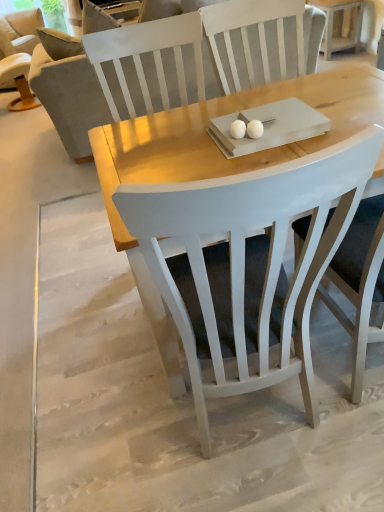
Question: Could you tell me if beige fabric chair at upper left, which is counted as the second chair, starting from the right, is facing white wood side table at upper right?

Choices:
 (A) no
 (B) yes

Answer: (B)

Question: Considering the relative positions of beige fabric chair at upper left, placed as the second chair when sorted from front to back, and white wood side table at upper right in the image provided, is beige fabric chair at upper left, placed as the second chair when sorted from front to back, to the left of white wood side table at upper right from the viewer's perspective?

Choices:
 (A) yes
 (B) no

Answer: (A)

Question: Does beige fabric chair at upper left, the second chair from the bottom, have a lesser width compared to white wood side table at upper right?

Choices:
 (A) no
 (B) yes

Answer: (A)

Question: From the image's perspective, does beige fabric chair at upper left, positioned as the first chair in back-to-front order, appear higher than white wood side table at upper right?

Choices:
 (A) no
 (B) yes

Answer: (B)

Question: Does beige fabric chair at upper left, placed as the second chair when sorted from front to back, lie in front of white wood side table at upper right?

Choices:
 (A) yes
 (B) no

Answer: (B)

Question: Considering the positions of beige fabric chair at upper left, which is counted as the second chair, starting from the right, and white wood side table at upper right in the image, is beige fabric chair at upper left, which is counted as the second chair, starting from the right, wider or thinner than white wood side table at upper right?

Choices:
 (A) thin
 (B) wide

Answer: (B)

Question: Is beige fabric chair at upper left, positioned as the first chair in back-to-front order, inside or outside of white wood side table at upper right?

Choices:
 (A) outside
 (B) inside

Answer: (A)

Question: From their relative heights in the image, would you say beige fabric chair at upper left, which ranks as the first chair in top-to-bottom order, is taller or shorter than white wood side table at upper right?

Choices:
 (A) tall
 (B) short

Answer: (A)

Question: In the image, is beige fabric chair at upper left, which is counted as the second chair, starting from the right, positioned in front of or behind white wood side table at upper right?

Choices:
 (A) behind
 (B) front

Answer: (A)

Question: From the image's perspective, is white wood side table at upper right above or below gray fabric couch at left?

Choices:
 (A) below
 (B) above

Answer: (B)

Question: Is point (344, 45) closer or farther from the camera than point (152, 59)?

Choices:
 (A) farther
 (B) closer

Answer: (A)

Question: Relative to gray fabric couch at left, is white wood side table at upper right in front or behind?

Choices:
 (A) front
 (B) behind

Answer: (B)

Question: From a real-world perspective, is white wood side table at upper right above or below gray fabric couch at left?

Choices:
 (A) above
 (B) below

Answer: (B)

Question: Looking at their shapes, would you say gray fabric couch at left is wider or thinner than beige fabric chair at upper left, which is counted as the second chair, starting from the right?

Choices:
 (A) thin
 (B) wide

Answer: (A)

Question: From the image's perspective, is gray fabric couch at left positioned above or below beige fabric chair at upper left, positioned as the first chair in back-to-front order?

Choices:
 (A) below
 (B) above

Answer: (A)